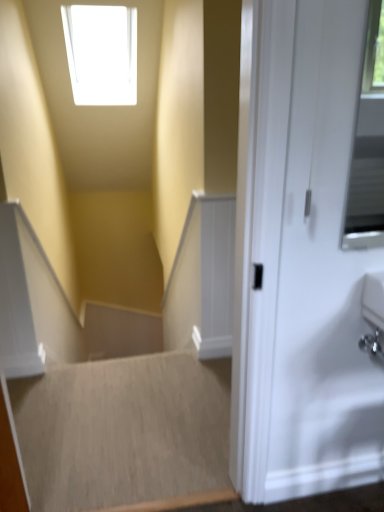
Describe the element at coordinates (56, 311) in the screenshot. The image size is (384, 512). I see `smooth beige carpet at center, which ranks as the second stairwell in back-to-front order` at that location.

Locate an element on the screen. smooth beige carpet at center, the 1th stairwell positioned from the front is located at coordinates (56, 311).

Describe the element at coordinates (123, 431) in the screenshot. I see `beige carpet at lower left, placed as the 2th stairwell when sorted from front to back` at that location.

Measure the distance between point (194, 476) and camera.

They are 1.69 meters apart.

Find the location of a particular element. Image resolution: width=384 pixels, height=512 pixels. beige carpet at lower left, placed as the 2th stairwell when sorted from front to back is located at coordinates (123, 431).

Where is `smooth beige carpet at center, the 1th stairwell positioned from the front`? This screenshot has height=512, width=384. smooth beige carpet at center, the 1th stairwell positioned from the front is located at coordinates (x=56, y=311).

Is beige carpet at lower left, arranged as the first stairwell when viewed from the back, at the left side of smooth beige carpet at center, which ranks as the second stairwell in back-to-front order?

Yes.

Considering their positions, is beige carpet at lower left, placed as the 2th stairwell when sorted from front to back, located in front of or behind smooth beige carpet at center, which ranks as the second stairwell in back-to-front order?

→ Clearly, beige carpet at lower left, placed as the 2th stairwell when sorted from front to back, is behind smooth beige carpet at center, which ranks as the second stairwell in back-to-front order.

Is point (135, 386) closer to viewer compared to point (22, 305)?

No, (135, 386) is behind (22, 305).

From the image's perspective, which object appears higher, beige carpet at lower left, placed as the 2th stairwell when sorted from front to back, or smooth beige carpet at center, which ranks as the second stairwell in back-to-front order?

smooth beige carpet at center, which ranks as the second stairwell in back-to-front order, is shown above in the image.

From a real-world perspective, between beige carpet at lower left, arranged as the first stairwell when viewed from the back, and smooth beige carpet at center, the 1th stairwell positioned from the front, who is vertically higher?

In real-world perspective, smooth beige carpet at center, the 1th stairwell positioned from the front, is above.

Which of these two, beige carpet at lower left, arranged as the first stairwell when viewed from the back, or smooth beige carpet at center, which ranks as the second stairwell in back-to-front order, is thinner?

Thinner between the two is smooth beige carpet at center, which ranks as the second stairwell in back-to-front order.

Who is shorter, beige carpet at lower left, placed as the 2th stairwell when sorted from front to back, or smooth beige carpet at center, the 1th stairwell positioned from the front?

Standing shorter between the two is beige carpet at lower left, placed as the 2th stairwell when sorted from front to back.

Considering the sizes of objects beige carpet at lower left, arranged as the first stairwell when viewed from the back, and smooth beige carpet at center, which ranks as the second stairwell in back-to-front order, in the image provided, who is smaller, beige carpet at lower left, arranged as the first stairwell when viewed from the back, or smooth beige carpet at center, which ranks as the second stairwell in back-to-front order,?

With smaller size is beige carpet at lower left, arranged as the first stairwell when viewed from the back.

Is beige carpet at lower left, placed as the 2th stairwell when sorted from front to back, completely or partially outside of smooth beige carpet at center, the 1th stairwell positioned from the front?

Yes, beige carpet at lower left, placed as the 2th stairwell when sorted from front to back, is not within smooth beige carpet at center, the 1th stairwell positioned from the front.

Are beige carpet at lower left, arranged as the first stairwell when viewed from the back, and smooth beige carpet at center, which ranks as the second stairwell in back-to-front order, making contact?

beige carpet at lower left, arranged as the first stairwell when viewed from the back, and smooth beige carpet at center, which ranks as the second stairwell in back-to-front order, are clearly separated.

Could you tell me if beige carpet at lower left, placed as the 2th stairwell when sorted from front to back, is facing smooth beige carpet at center, the 1th stairwell positioned from the front?

No, beige carpet at lower left, placed as the 2th stairwell when sorted from front to back, does not turn towards smooth beige carpet at center, the 1th stairwell positioned from the front.

Can you tell me how much beige carpet at lower left, arranged as the first stairwell when viewed from the back, and smooth beige carpet at center, which ranks as the second stairwell in back-to-front order, differ in facing direction?

They differ by 0.786 degrees in their facing directions.

Where is `stairwell behind the smooth beige carpet at center, the 1th stairwell positioned from the front`? The image size is (384, 512). stairwell behind the smooth beige carpet at center, the 1th stairwell positioned from the front is located at coordinates (123, 431).

Considering the positions of objects smooth beige carpet at center, the 1th stairwell positioned from the front, and beige carpet at lower left, placed as the 2th stairwell when sorted from front to back, in the image provided, who is more to the left, smooth beige carpet at center, the 1th stairwell positioned from the front, or beige carpet at lower left, placed as the 2th stairwell when sorted from front to back,?

beige carpet at lower left, placed as the 2th stairwell when sorted from front to back.

Which is behind, smooth beige carpet at center, the 1th stairwell positioned from the front, or beige carpet at lower left, arranged as the first stairwell when viewed from the back?

beige carpet at lower left, arranged as the first stairwell when viewed from the back, is more distant.

Which point is more forward, (x=213, y=394) or (x=101, y=419)?

The point (x=101, y=419) is closer to the camera.

From the image's perspective, is smooth beige carpet at center, the 1th stairwell positioned from the front, located above or below beige carpet at lower left, arranged as the first stairwell when viewed from the back?

Clearly, from the image's perspective, smooth beige carpet at center, the 1th stairwell positioned from the front, is above beige carpet at lower left, arranged as the first stairwell when viewed from the back.

From a real-world perspective, relative to beige carpet at lower left, placed as the 2th stairwell when sorted from front to back, is smooth beige carpet at center, which ranks as the second stairwell in back-to-front order, vertically above or below?

Clearly, from a real-world perspective, smooth beige carpet at center, which ranks as the second stairwell in back-to-front order, is above beige carpet at lower left, placed as the 2th stairwell when sorted from front to back.

Is smooth beige carpet at center, which ranks as the second stairwell in back-to-front order, thinner than beige carpet at lower left, arranged as the first stairwell when viewed from the back?

Correct, the width of smooth beige carpet at center, which ranks as the second stairwell in back-to-front order, is less than that of beige carpet at lower left, arranged as the first stairwell when viewed from the back.

Considering the sizes of objects smooth beige carpet at center, the 1th stairwell positioned from the front, and beige carpet at lower left, arranged as the first stairwell when viewed from the back, in the image provided, who is shorter, smooth beige carpet at center, the 1th stairwell positioned from the front, or beige carpet at lower left, arranged as the first stairwell when viewed from the back,?

Standing shorter between the two is beige carpet at lower left, arranged as the first stairwell when viewed from the back.

Considering the sizes of smooth beige carpet at center, the 1th stairwell positioned from the front, and beige carpet at lower left, arranged as the first stairwell when viewed from the back, in the image, is smooth beige carpet at center, the 1th stairwell positioned from the front, bigger or smaller than beige carpet at lower left, arranged as the first stairwell when viewed from the back,?

smooth beige carpet at center, the 1th stairwell positioned from the front, is bigger than beige carpet at lower left, arranged as the first stairwell when viewed from the back.

Would you say smooth beige carpet at center, the 1th stairwell positioned from the front, is inside or outside beige carpet at lower left, arranged as the first stairwell when viewed from the back?

smooth beige carpet at center, the 1th stairwell positioned from the front, is spatially situated outside beige carpet at lower left, arranged as the first stairwell when viewed from the back.

In the scene shown: Is smooth beige carpet at center, the 1th stairwell positioned from the front, next to beige carpet at lower left, arranged as the first stairwell when viewed from the back, and touching it?

No, smooth beige carpet at center, the 1th stairwell positioned from the front, is not in contact with beige carpet at lower left, arranged as the first stairwell when viewed from the back.

Could you tell me if smooth beige carpet at center, which ranks as the second stairwell in back-to-front order, is turned towards beige carpet at lower left, placed as the 2th stairwell when sorted from front to back?

No, smooth beige carpet at center, which ranks as the second stairwell in back-to-front order, is not turned towards beige carpet at lower left, placed as the 2th stairwell when sorted from front to back.

Measure the distance from smooth beige carpet at center, which ranks as the second stairwell in back-to-front order, to beige carpet at lower left, placed as the 2th stairwell when sorted from front to back.

The distance of smooth beige carpet at center, which ranks as the second stairwell in back-to-front order, from beige carpet at lower left, placed as the 2th stairwell when sorted from front to back, is 24.43 inches.

This screenshot has width=384, height=512. Find the location of `stairwell located above the beige carpet at lower left, placed as the 2th stairwell when sorted from front to back (from a real-world perspective)`. stairwell located above the beige carpet at lower left, placed as the 2th stairwell when sorted from front to back (from a real-world perspective) is located at coordinates (56, 311).

Locate an element on the screen. Image resolution: width=384 pixels, height=512 pixels. stairwell behind the smooth beige carpet at center, which ranks as the second stairwell in back-to-front order is located at coordinates (123, 431).

This screenshot has height=512, width=384. In order to click on stairwell that is on the right side of beige carpet at lower left, arranged as the first stairwell when viewed from the back in this screenshot , I will do `click(56, 311)`.